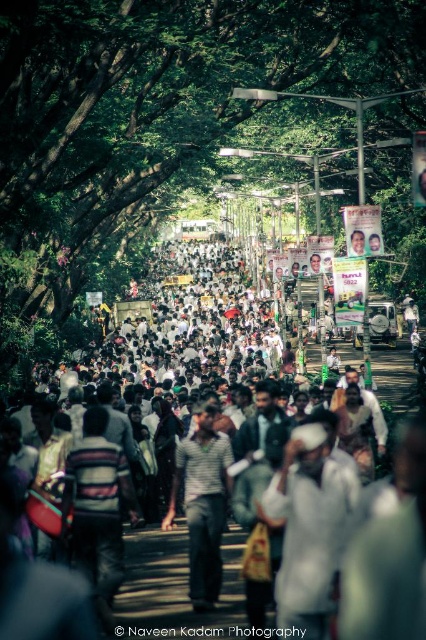
You are standing at the point marked as point [181,340] on the right side of the street. Looking towards the center, you see a crowd of people. What do you observe about the clothing color of the crowd in front of you?

The crowd at the center has white clothing.

You are standing in the middle of the street and see the green leafy tree at center and the striped fabric shirt at center. Which object is located to the right of the other?

The green leafy tree at center is positioned on the right side of striped fabric shirt at center.

You are a photographer standing in the middle of the street. You want to take a photo that includes both the green leafy tree at center and the striped fabric shirt at center. Which object should you focus on first to ensure both are in frame?

You should focus on the green leafy tree at center first because it is larger than the striped fabric shirt at center, so it will require more space in the frame.